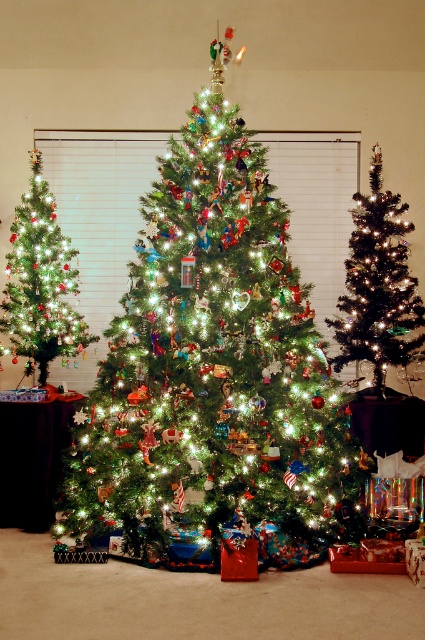
Between iridescent glass ornaments at center and shiny silver christmas tree at center, which one appears on the right side from the viewer's perspective?

shiny silver christmas tree at center is more to the right.

This screenshot has width=425, height=640. What do you see at coordinates (212, 372) in the screenshot?
I see `iridescent glass ornaments at center` at bounding box center [212, 372].

Between point (158, 468) and point (379, 374), which one is positioned behind?

The point (379, 374) is more distant.

The image size is (425, 640). I want to click on iridescent glass ornaments at center, so click(x=212, y=372).

Which is below, iridescent glass ornaments at center or green matte christmas tree at left?

iridescent glass ornaments at center

Is iridescent glass ornaments at center below green matte christmas tree at left?

Yes, iridescent glass ornaments at center is below green matte christmas tree at left.

Where is `iridescent glass ornaments at center`? This screenshot has height=640, width=425. iridescent glass ornaments at center is located at coordinates (212, 372).

You are a GUI agent. You are given a task and a screenshot of the screen. Output one action in this format:
    pyautogui.click(x=<x>, y=<y>)
    Task: Click on the iridescent glass ornaments at center
    The image size is (425, 640).
    Given the screenshot: What is the action you would take?
    pyautogui.click(x=212, y=372)

Which is below, shiny silver christmas tree at center or green matte christmas tree at left?

shiny silver christmas tree at center is below.

Which is in front, point (382, 224) or point (23, 205)?

Point (382, 224) is more forward.

The height and width of the screenshot is (640, 425). I want to click on shiny silver christmas tree at center, so click(377, 285).